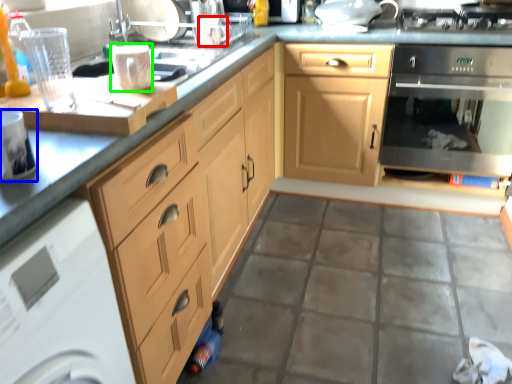
Question: Which is farther away from appliance (highlighted by a red box)? kitchen appliance (highlighted by a blue box) or appliance (highlighted by a green box)?

Choices:
 (A) kitchen appliance
 (B) appliance

Answer: (A)